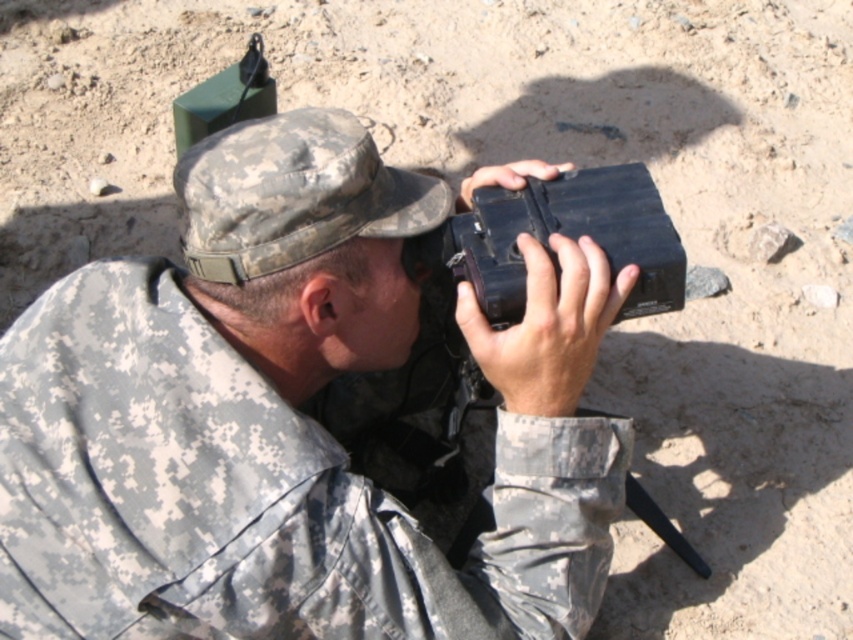
Who is lower down, matte black case at upper center or black matte camera at center?

Positioned lower is matte black case at upper center.

Is point (155, 492) farther from viewer compared to point (556, 220)?

No, it is in front of (556, 220).

This screenshot has height=640, width=853. Find the location of `matte black case at upper center`. matte black case at upper center is located at coordinates (289, 419).